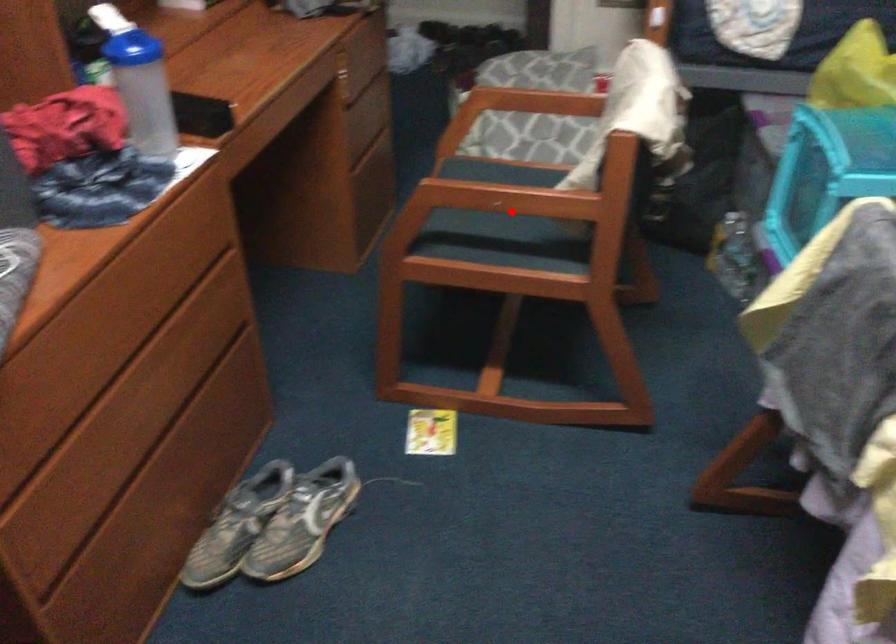
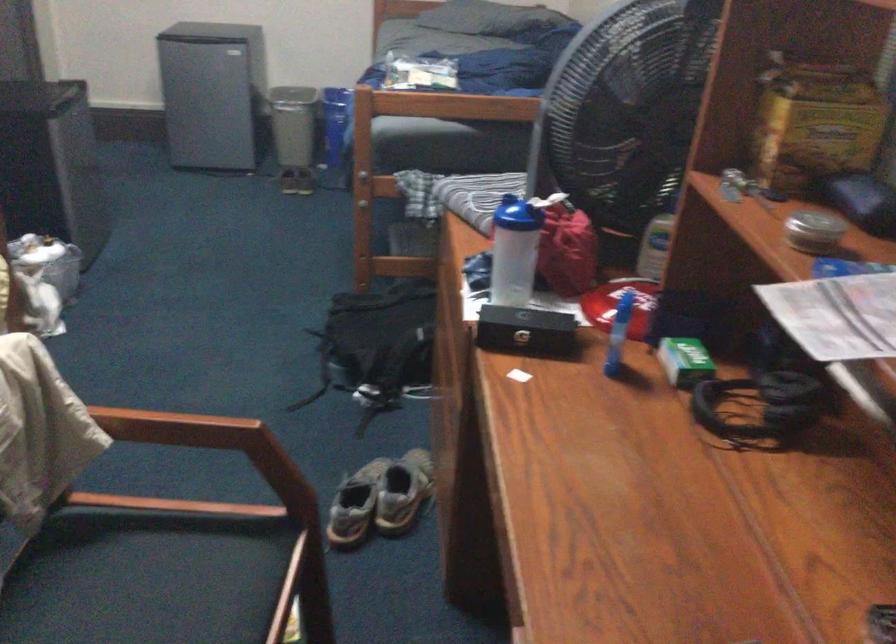
Question: I am providing you with two images of the same scene from different viewpoints. In image1, a red point is highlighted. Considering the same 3D point in image2, which of the following is correct?

Choices:
 (A) It is closer
 (B) It is farther

Answer: (A)